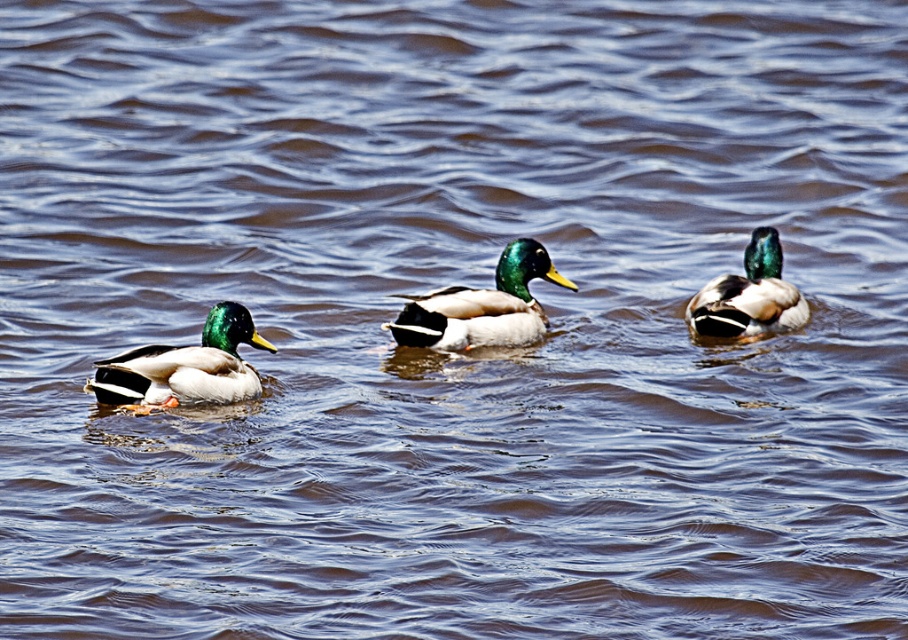
You are a photographer trying to capture the shiny green drake at left and the green glossy duck at center in a single shot. Since you want both ducks to be clearly visible, which duck should you position closer to the center of your camera frame to ensure both are in focus?

You should position the green glossy duck at center closer to the center of your camera frame because the shiny green drake at left is already to the left of it, making the green glossy duck at center naturally closer to the middle.

Looking at this image, you are a wildlife photographer aiming to capture a photo of the green glossy duck at center and the shiny green head at right. If your camera has a maximum focus range of 30 inches, will you be able to focus on both ducks simultaneously?

The green glossy duck at center is 35.00 inches away from the shiny green head at right. Since the distance between them exceeds the camera lens focus range of 30 inches, you cannot focus on both ducks at the same time.

You are observing the ducks in the scene. There are two points marked in the image. Which point is closer to you, point (396, 336) or point (777, 317)?

Point (396, 336) is closer to the camera than point (777, 317).